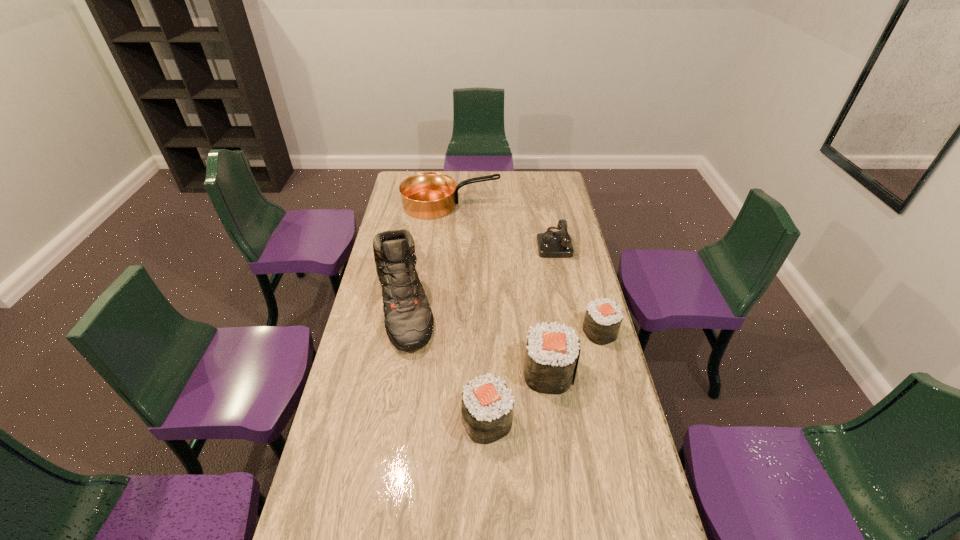
Image resolution: width=960 pixels, height=540 pixels. What are the coordinates of `object situated at the far left corner` in the screenshot? It's located at (429, 195).

Identify the location of free space at the far edge of the desktop. (463, 192).

Where is `vacant area at the near edge`? Image resolution: width=960 pixels, height=540 pixels. vacant area at the near edge is located at coordinates (528, 519).

In the image, there is a desktop. Identify the location of vacant space at the left edge. (373, 292).

Find the location of a particular element. The width and height of the screenshot is (960, 540). free region at the right edge is located at coordinates (617, 376).

The width and height of the screenshot is (960, 540). In order to click on blank space at the near left corner of the desktop in this screenshot , I will do `click(339, 527)`.

Where is `free space at the near right corner`? The height and width of the screenshot is (540, 960). free space at the near right corner is located at coordinates (605, 513).

Find the location of a particular element. This screenshot has width=960, height=540. free area in between the ski boot and the nearest sushi is located at coordinates (445, 364).

At what (x,y) coordinates should I click in order to perform the action: click on vacant point located between the second nearest sushi and the farthest object. Please return your answer as a coordinate pair (x, y). Looking at the image, I should click on (499, 288).

The height and width of the screenshot is (540, 960). What are the coordinates of `vacant area that lies between the second nearest sushi and the second shortest sushi` in the screenshot? It's located at (518, 396).